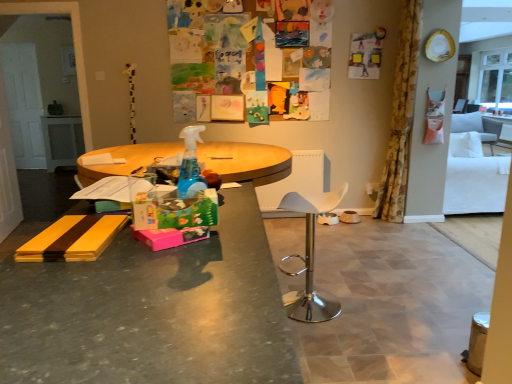
Question: Could you tell me if matte gray desk at center is turned towards brown ceramic bowl at center, the 1th bowl when ordered from right to left?

Choices:
 (A) yes
 (B) no

Answer: (B)

Question: Is brown ceramic bowl at center, the second bowl in the left-to-right sequence, inside matte gray desk at center?

Choices:
 (A) no
 (B) yes

Answer: (A)

Question: Is matte gray desk at center smaller than brown ceramic bowl at center, the 1th bowl when ordered from right to left?

Choices:
 (A) no
 (B) yes

Answer: (A)

Question: Considering the relative positions of matte gray desk at center and brown ceramic bowl at center, the second bowl in the left-to-right sequence, in the image provided, is matte gray desk at center in front of brown ceramic bowl at center, the second bowl in the left-to-right sequence,?

Choices:
 (A) yes
 (B) no

Answer: (A)

Question: Is matte gray desk at center directly adjacent to brown ceramic bowl at center, the 1th bowl when ordered from right to left?

Choices:
 (A) no
 (B) yes

Answer: (A)

Question: Is white fabric armchair at right, placed as the first armchair when sorted from front to back, spatially inside brown ceramic bowl at center, the second bowl in the left-to-right sequence, or outside of it?

Choices:
 (A) outside
 (B) inside

Answer: (A)

Question: Relative to brown ceramic bowl at center, the second bowl in the left-to-right sequence, is white fabric armchair at right, acting as the second armchair starting from the back, in front or behind?

Choices:
 (A) front
 (B) behind

Answer: (B)

Question: In terms of size, does white fabric armchair at right, acting as the second armchair starting from the back, appear bigger or smaller than brown ceramic bowl at center, the second bowl in the left-to-right sequence?

Choices:
 (A) small
 (B) big

Answer: (B)

Question: In the image, is white fabric armchair at right, the 2th armchair viewed from the right, on the left side or the right side of brown ceramic bowl at center, the 1th bowl when ordered from right to left?

Choices:
 (A) left
 (B) right

Answer: (B)

Question: Visually, is brown ceramic bowl at center, the 1th bowl when ordered from right to left, positioned to the left or to the right of matte gray desk at center?

Choices:
 (A) right
 (B) left

Answer: (A)

Question: From a real-world perspective, is brown ceramic bowl at center, the second bowl in the left-to-right sequence, physically located above or below matte gray desk at center?

Choices:
 (A) above
 (B) below

Answer: (B)

Question: Looking at their shapes, would you say brown ceramic bowl at center, the 1th bowl when ordered from right to left, is wider or thinner than matte gray desk at center?

Choices:
 (A) wide
 (B) thin

Answer: (B)

Question: Do you think brown ceramic bowl at center, the 1th bowl when ordered from right to left, is within matte gray desk at center, or outside of it?

Choices:
 (A) inside
 (B) outside

Answer: (B)

Question: From the image's perspective, is floral fabric curtain at right positioned above or below brown ceramic bowl at center, the 1th bowl when ordered from right to left?

Choices:
 (A) above
 (B) below

Answer: (A)

Question: Considering the positions of floral fabric curtain at right and brown ceramic bowl at center, the second bowl in the left-to-right sequence, in the image, is floral fabric curtain at right taller or shorter than brown ceramic bowl at center, the second bowl in the left-to-right sequence,?

Choices:
 (A) short
 (B) tall

Answer: (B)